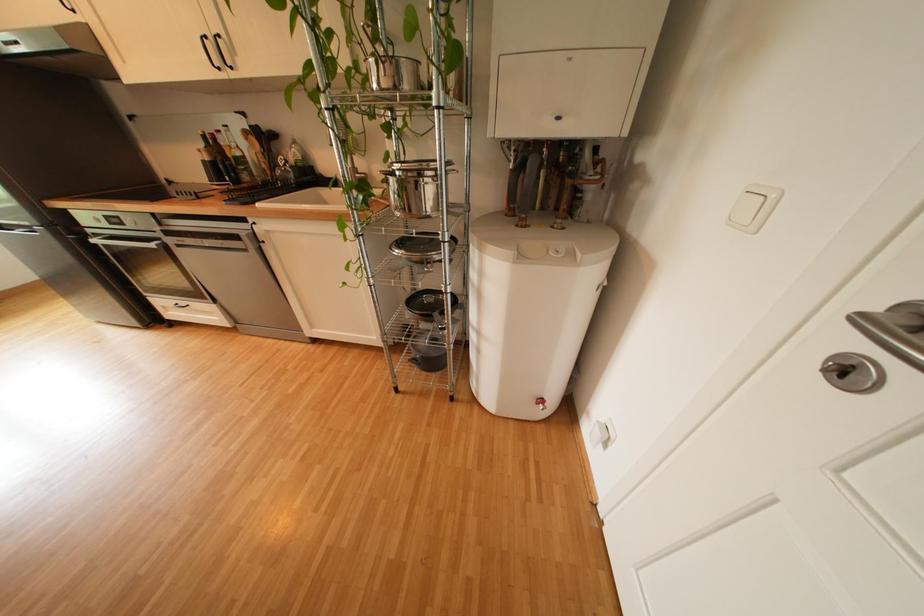
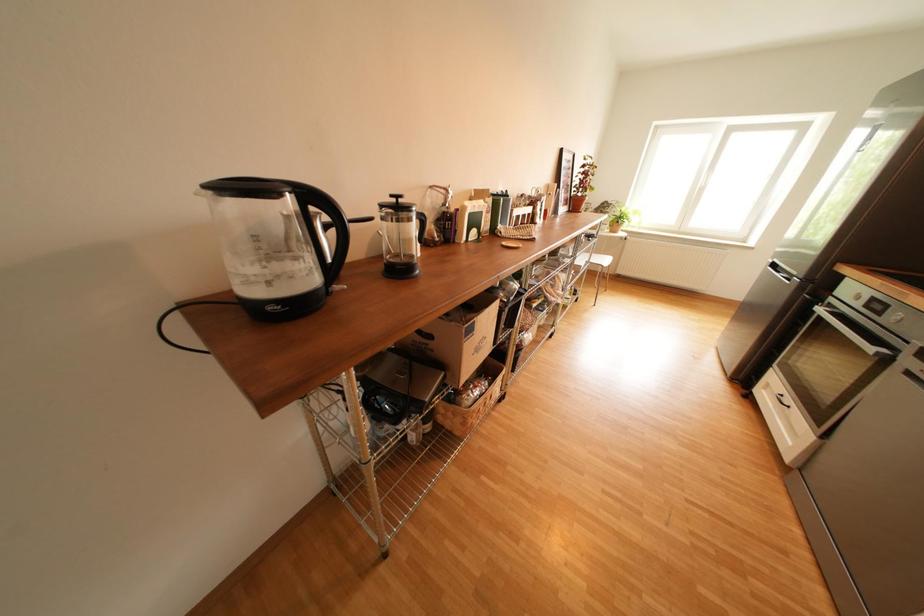
How did the camera likely rotate?

The rotation direction of the camera is left-down.